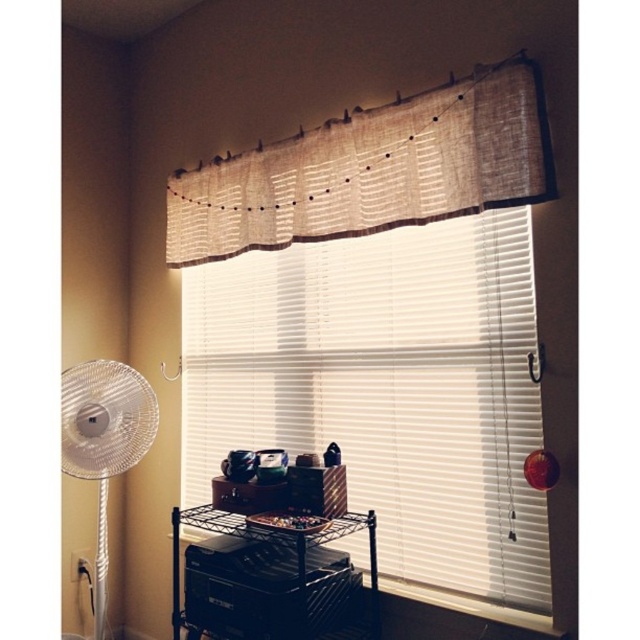
Question: Which is farther from the black metal cart at center?

Choices:
 (A) transparent plastic fan at left
 (B) white blinds at center

Answer: (A)

Question: Can you confirm if white blinds at center is smaller than transparent plastic fan at left?

Choices:
 (A) yes
 (B) no

Answer: (B)

Question: Which point is closer to the camera taking this photo?

Choices:
 (A) (317, 600)
 (B) (83, 476)

Answer: (A)

Question: Where is white blinds at center located in relation to burlap curtain at upper center in the image?

Choices:
 (A) above
 (B) below

Answer: (B)

Question: Can you confirm if white blinds at center is positioned above black metal cart at center?

Choices:
 (A) yes
 (B) no

Answer: (A)

Question: Which object is closer to the camera taking this photo?

Choices:
 (A) white blinds at center
 (B) burlap curtain at upper center

Answer: (B)